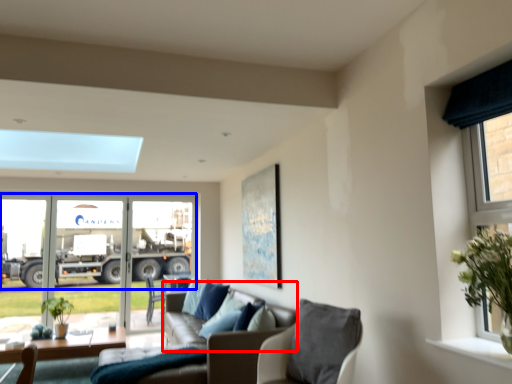
Question: Which object appears farthest to the camera in this image, couch (highlighted by a red box) or trailer truck (highlighted by a blue box)?

Choices:
 (A) couch
 (B) trailer truck

Answer: (B)